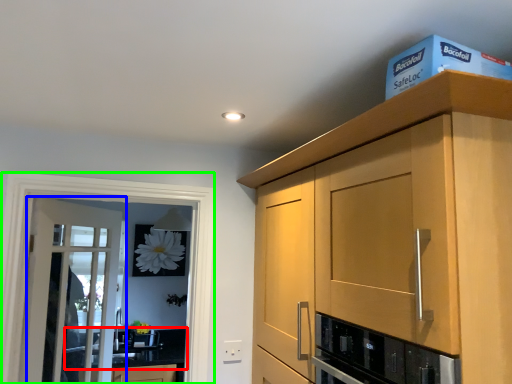
Question: Based on their relative distances, which object is farther from countertop (highlighted by a red box)? Choose from door (highlighted by a blue box) and screen door (highlighted by a green box).

Choices:
 (A) door
 (B) screen door

Answer: (B)